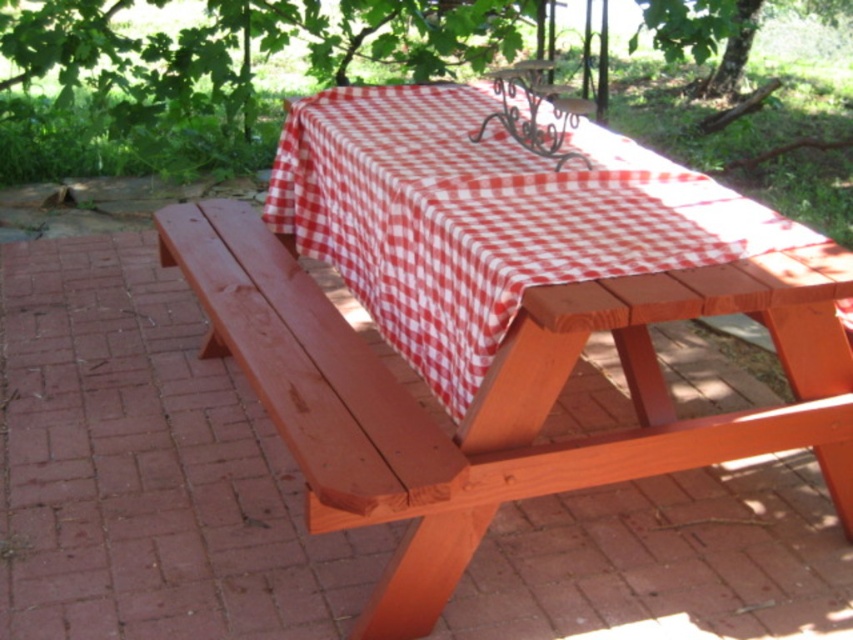
Question: Which point appears farthest from the camera in this image?

Choices:
 (A) (653, 44)
 (B) (332, 108)
 (C) (282, 300)

Answer: (A)

Question: Which object is the farthest from the green leafy tree at upper center?

Choices:
 (A) smooth wood bench at left
 (B) red checkered tablecloth at center

Answer: (A)

Question: Which is nearer to the red checkered tablecloth at center?

Choices:
 (A) green leafy tree at upper center
 (B) smooth wood bench at left

Answer: (B)

Question: Does red checkered tablecloth at center have a lesser width compared to green leafy tree at upper center?

Choices:
 (A) no
 (B) yes

Answer: (A)

Question: Does red checkered tablecloth at center appear on the left side of green leafy tree at upper center?

Choices:
 (A) no
 (B) yes

Answer: (B)

Question: Can you confirm if red checkered tablecloth at center is thinner than green leafy tree at upper center?

Choices:
 (A) yes
 (B) no

Answer: (B)